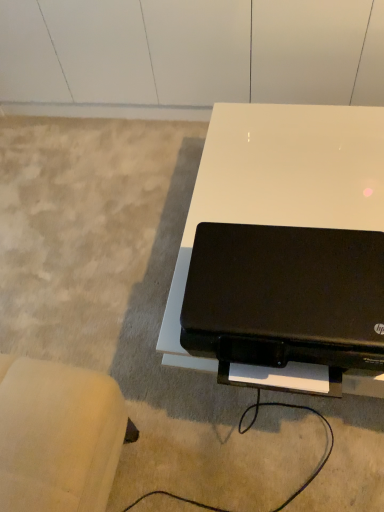
Find the location of a particular element. The height and width of the screenshot is (512, 384). free space to the back side of black matte laptop at lower right is located at coordinates (278, 194).